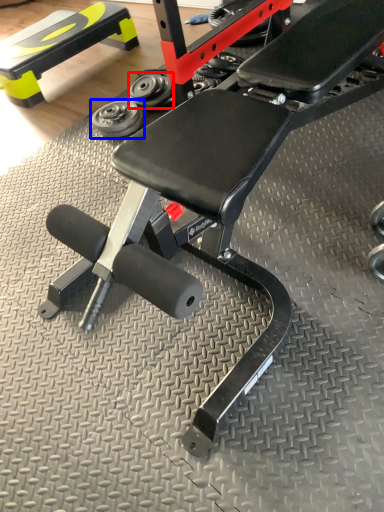
Question: Which object is closer to the camera taking this photo, dumbbell (highlighted by a red box) or dumbbell (highlighted by a blue box)?

Choices:
 (A) dumbbell
 (B) dumbbell

Answer: (B)